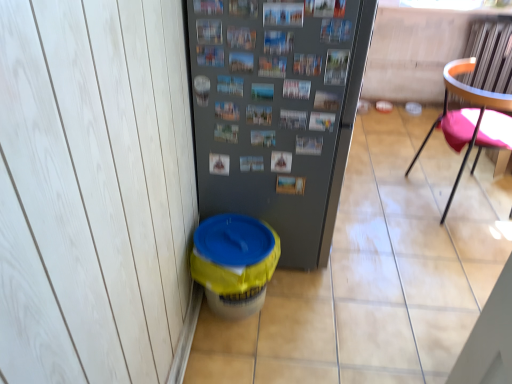
Question: Is orange plastic chair at right taller than metallic gray refrigerator at center?

Choices:
 (A) no
 (B) yes

Answer: (A)

Question: Is metallic gray refrigerator at center inside orange plastic chair at right?

Choices:
 (A) yes
 (B) no

Answer: (B)

Question: From the image's perspective, is orange plastic chair at right over metallic gray refrigerator at center?

Choices:
 (A) no
 (B) yes

Answer: (A)

Question: Can you confirm if orange plastic chair at right is positioned to the right of metallic gray refrigerator at center?

Choices:
 (A) no
 (B) yes

Answer: (B)

Question: Can you confirm if orange plastic chair at right is shorter than metallic gray refrigerator at center?

Choices:
 (A) no
 (B) yes

Answer: (B)

Question: Considering the relative sizes of orange plastic chair at right and metallic gray refrigerator at center in the image provided, is orange plastic chair at right wider than metallic gray refrigerator at center?

Choices:
 (A) no
 (B) yes

Answer: (A)

Question: Is yellow plastic potty at lower left further to camera compared to orange plastic chair at right?

Choices:
 (A) no
 (B) yes

Answer: (A)

Question: From the image's perspective, is yellow plastic potty at lower left located beneath orange plastic chair at right?

Choices:
 (A) yes
 (B) no

Answer: (A)

Question: Does yellow plastic potty at lower left have a greater width compared to orange plastic chair at right?

Choices:
 (A) yes
 (B) no

Answer: (B)

Question: Can you confirm if yellow plastic potty at lower left is taller than orange plastic chair at right?

Choices:
 (A) no
 (B) yes

Answer: (A)

Question: Would you say yellow plastic potty at lower left is outside orange plastic chair at right?

Choices:
 (A) no
 (B) yes

Answer: (B)

Question: Considering the relative sizes of yellow plastic potty at lower left and orange plastic chair at right in the image provided, is yellow plastic potty at lower left thinner than orange plastic chair at right?

Choices:
 (A) yes
 (B) no

Answer: (A)

Question: Does yellow plastic potty at lower left turn towards metallic gray refrigerator at center?

Choices:
 (A) no
 (B) yes

Answer: (A)